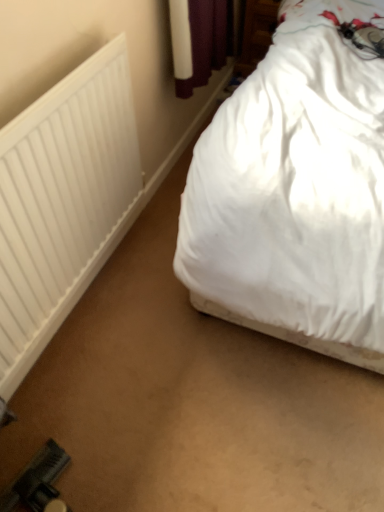
Question: From a real-world perspective, relative to white soft bed at upper right, is white matte radiator at left vertically above or below?

Choices:
 (A) above
 (B) below

Answer: (B)

Question: Considering the positions of white matte radiator at left and white soft bed at upper right in the image, is white matte radiator at left wider or thinner than white soft bed at upper right?

Choices:
 (A) thin
 (B) wide

Answer: (A)

Question: Is white matte radiator at left spatially inside white soft bed at upper right, or outside of it?

Choices:
 (A) inside
 (B) outside

Answer: (B)

Question: Considering the positions of point (261, 157) and point (89, 278), is point (261, 157) closer or farther from the camera than point (89, 278)?

Choices:
 (A) closer
 (B) farther

Answer: (A)

Question: Is white soft bed at upper right in front of or behind white matte radiator at left in the image?

Choices:
 (A) front
 (B) behind

Answer: (A)

Question: Is white soft bed at upper right situated inside white matte radiator at left or outside?

Choices:
 (A) outside
 (B) inside

Answer: (A)

Question: From a real-world perspective, is white soft bed at upper right physically located above or below white matte radiator at left?

Choices:
 (A) below
 (B) above

Answer: (B)